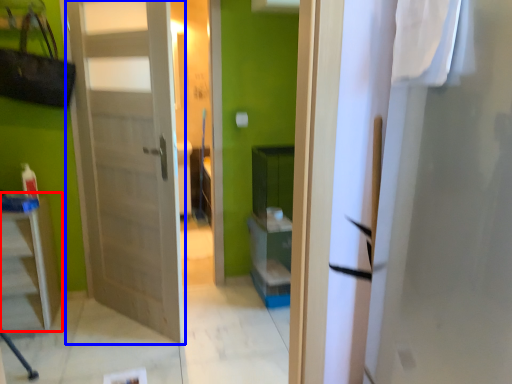
Question: Which of the following is the closest to the observer, furniture (highlighted by a red box) or door (highlighted by a blue box)?

Choices:
 (A) furniture
 (B) door

Answer: (B)